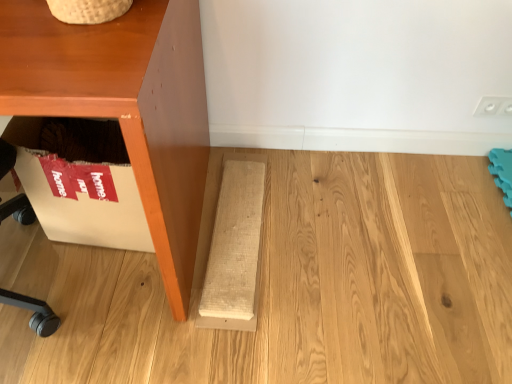
Identify the location of vacant space positioned to the left of natural wood plank at lower center. The height and width of the screenshot is (384, 512). (87, 281).